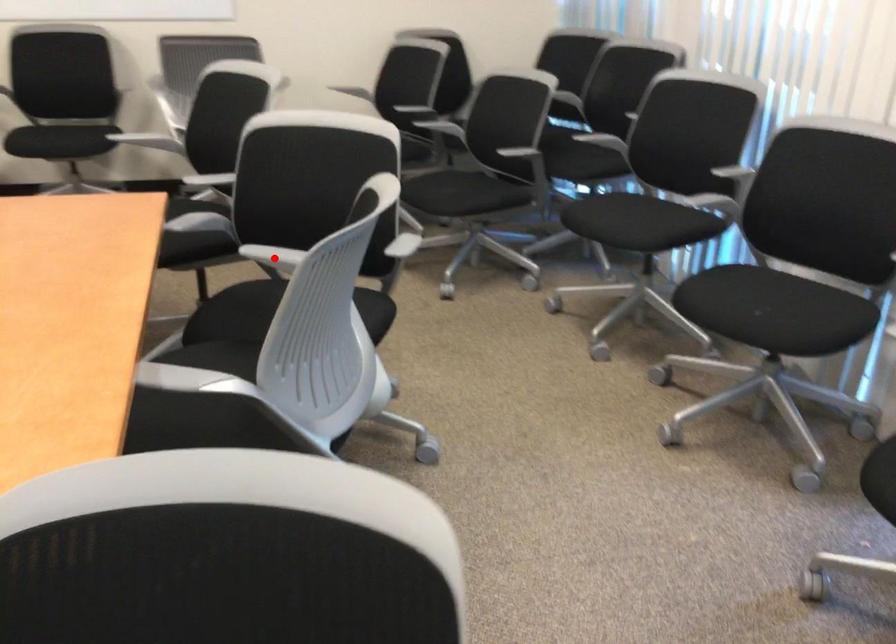
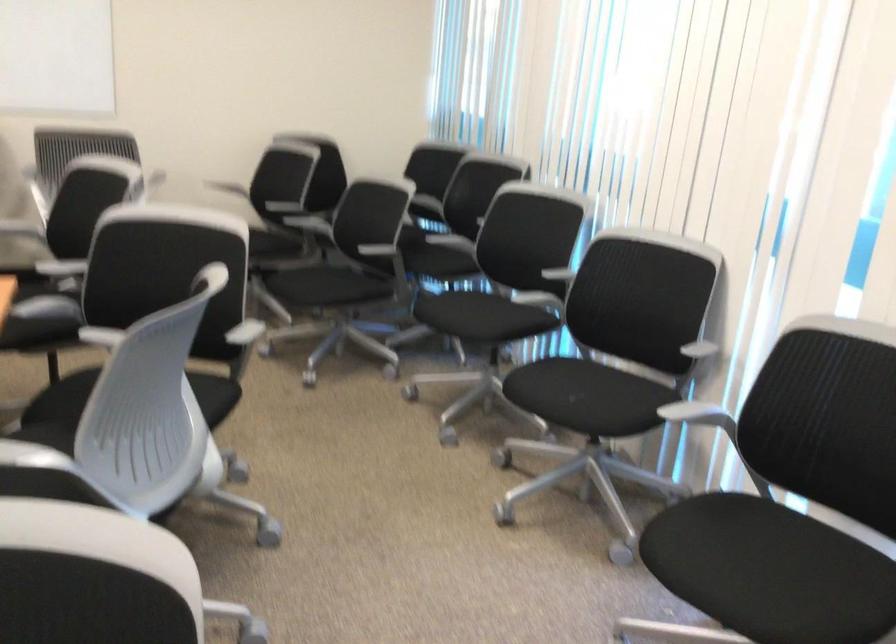
Question: I am providing you with two images of the same scene from different viewpoints. A red point is marked on the first image. Is the red point's position out of view in image 2?

Choices:
 (A) Yes
 (B) No

Answer: (A)